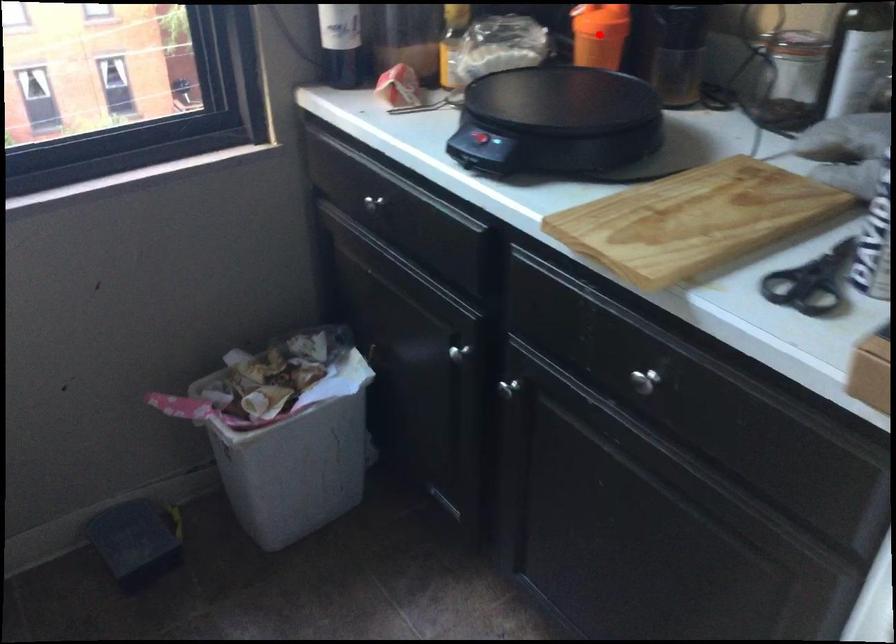
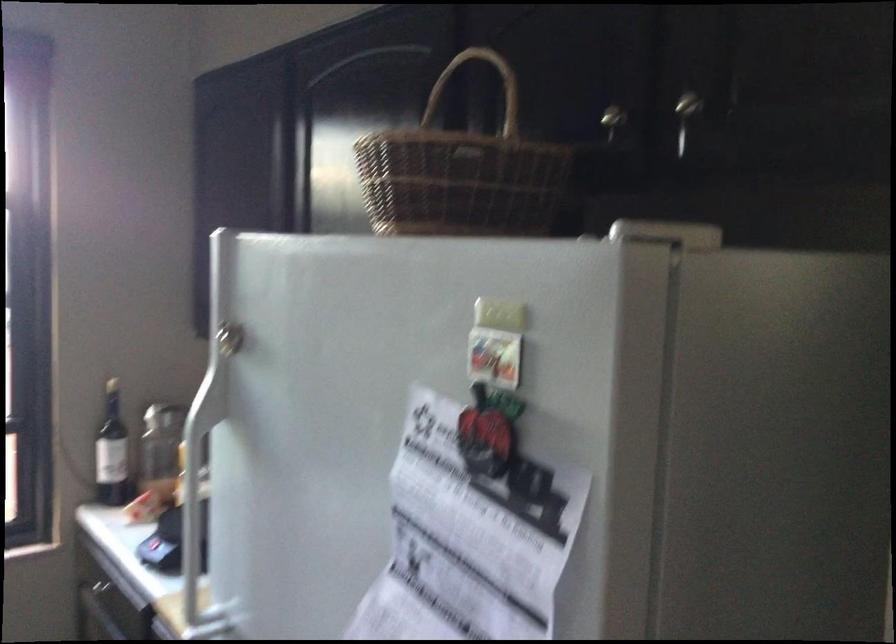
Question: I am providing you with two images of the same scene from different viewpoints. A red point is marked on the first image. Is the red point's position out of view in image 2?

Choices:
 (A) Yes
 (B) No

Answer: (A)